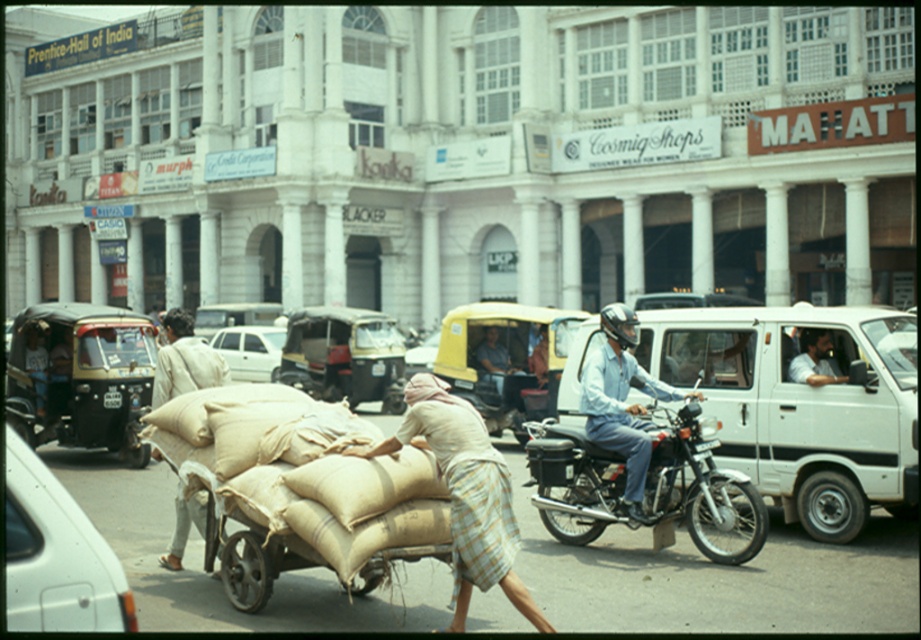
You are standing at the origin point in the image. Where is the brown woven cart at center located?

The brown woven cart at center is located at point (315, 516).